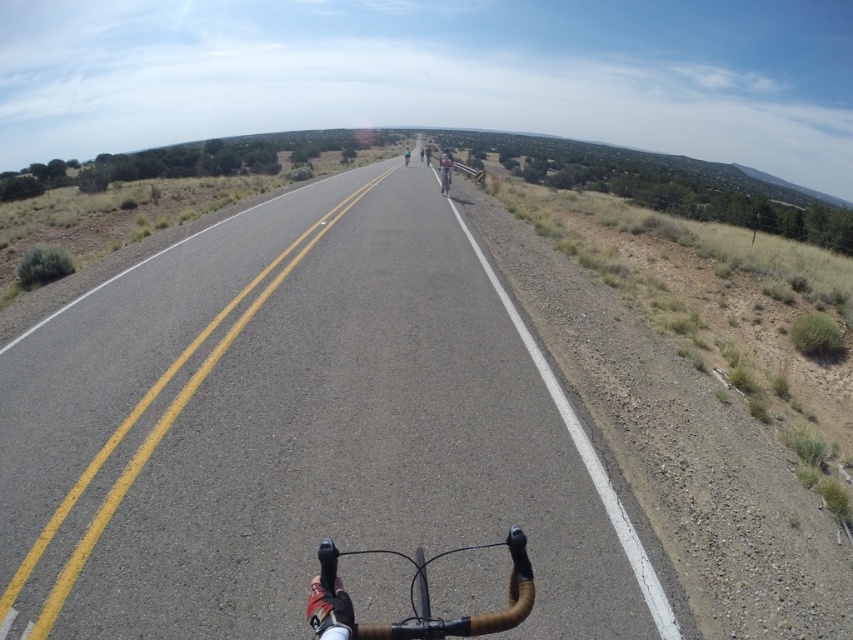
Is asphalt road at center bigger than black matte helmet at center?

Actually, asphalt road at center might be smaller than black matte helmet at center.

In the scene shown: Who is more distant from viewer, (345,452) or (445,166)?

Positioned behind is point (445,166).

Image resolution: width=853 pixels, height=640 pixels. Find the location of `asphalt road at center`. asphalt road at center is located at coordinates (296, 429).

Which is below, brown leather handlebars at center or light blue fabric cyclist at center?

brown leather handlebars at center is below.

In the scene shown: Between brown leather handlebars at center and light blue fabric cyclist at center, which one is positioned higher?

light blue fabric cyclist at center is above.

Does point (518, 611) lie in front of point (405, 150)?

Yes, it is.

The image size is (853, 640). In order to click on brown leather handlebars at center in this screenshot , I will do `click(418, 600)`.

Can you confirm if asphalt road at center is wider than shiny silver bicycle at center?

Yes, asphalt road at center is wider than shiny silver bicycle at center.

Can you confirm if asphalt road at center is positioned to the right of shiny silver bicycle at center?

In fact, asphalt road at center is to the left of shiny silver bicycle at center.

What do you see at coordinates (296, 429) in the screenshot? This screenshot has height=640, width=853. I see `asphalt road at center` at bounding box center [296, 429].

At what (x,y) coordinates should I click in order to perform the action: click on asphalt road at center. Please return your answer as a coordinate pair (x, y). Looking at the image, I should click on (296, 429).